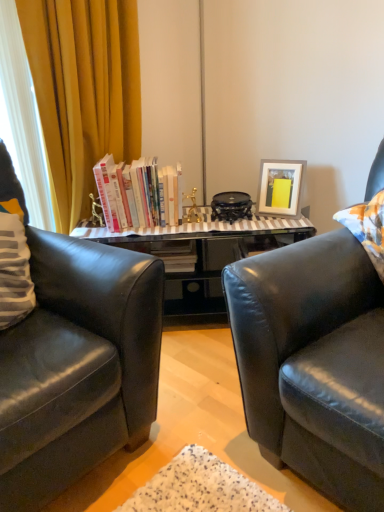
Question: Is yellow fabric curtain at left taller or shorter than black leather chair at left?

Choices:
 (A) short
 (B) tall

Answer: (B)

Question: Is point (66, 150) positioned closer to the camera than point (56, 267)?

Choices:
 (A) closer
 (B) farther

Answer: (B)

Question: Which of these objects is positioned farthest from the yellow fabric curtain at left?

Choices:
 (A) matte gray picture frame at upper right
 (B) hardcover books at center
 (C) black leather chair at left

Answer: (A)

Question: Considering the real-world distances, which object is closest to the black leather chair at left?

Choices:
 (A) yellow fabric curtain at left
 (B) matte gray picture frame at upper right
 (C) hardcover books at center

Answer: (C)